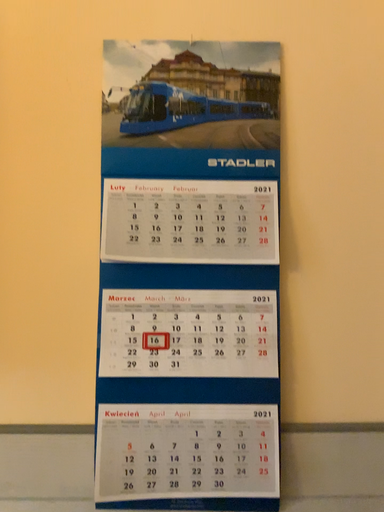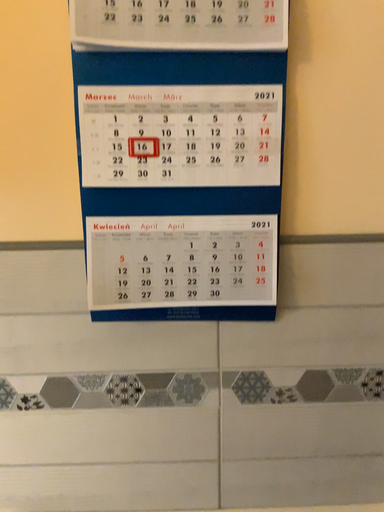
Question: Which way did the camera rotate in the video?

Choices:
 (A) rotated upward
 (B) rotated downward

Answer: (B)